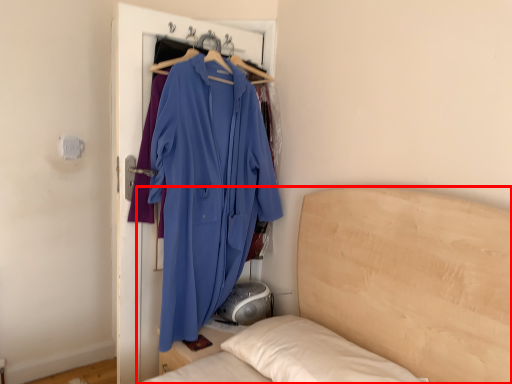
Question: Where is bed (annotated by the red box) located in relation to fancy dress in the image?

Choices:
 (A) right
 (B) left

Answer: (A)